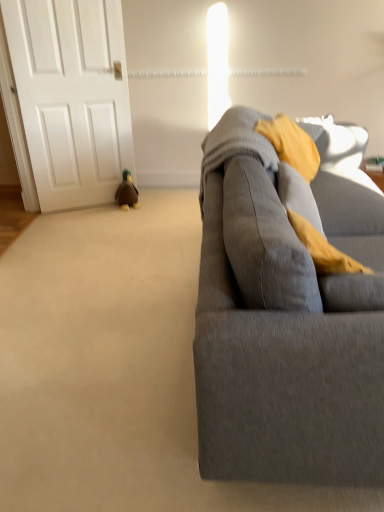
Describe the element at coordinates (127, 192) in the screenshot. I see `brown plush duck at lower left` at that location.

Image resolution: width=384 pixels, height=512 pixels. Identify the location of gray fabric couch at right. (288, 316).

Can you confirm if brown plush duck at lower left is thinner than white matte door at left?

Incorrect, the width of brown plush duck at lower left is not less than that of white matte door at left.

Is brown plush duck at lower left bigger or smaller than white matte door at left?

Clearly, brown plush duck at lower left is smaller in size than white matte door at left.

Could you tell me if brown plush duck at lower left is facing white matte door at left?

No, brown plush duck at lower left is not aimed at white matte door at left.

Is there a large distance between brown plush duck at lower left and white matte door at left?

No, brown plush duck at lower left is in close proximity to white matte door at left.

What's the angular difference between gray fabric couch at right and white matte door at left's facing directions?

The facing directions of gray fabric couch at right and white matte door at left are 65.6 degrees apart.

Is gray fabric couch at right not close to white matte door at left?

Absolutely, gray fabric couch at right is distant from white matte door at left.

Can you confirm if gray fabric couch at right is positioned to the left of white matte door at left?

No.

Is gray fabric couch at right positioned in front of white matte door at left?

Yes, gray fabric couch at right is in front of white matte door at left.

Which object is wider, white matte door at left or gray fabric couch at right?

Wider between the two is gray fabric couch at right.

Is white matte door at left bigger than gray fabric couch at right?

Actually, white matte door at left might be smaller than gray fabric couch at right.

Does white matte door at left have a greater height compared to gray fabric couch at right?

Indeed, white matte door at left has a greater height compared to gray fabric couch at right.

From the image's perspective, is white matte door at left above or below brown plush duck at lower left?

white matte door at left is above brown plush duck at lower left.

Where is `door above the brown plush duck at lower left (from the image's perspective)`? Image resolution: width=384 pixels, height=512 pixels. door above the brown plush duck at lower left (from the image's perspective) is located at coordinates pyautogui.click(x=67, y=100).

Based on the photo, is white matte door at left in front of or behind brown plush duck at lower left in the image?

Visually, white matte door at left is located in front of brown plush duck at lower left.

From a real-world perspective, who is located lower, white matte door at left or brown plush duck at lower left?

brown plush duck at lower left.

Is point (259, 256) positioned after point (119, 191)?

No, (259, 256) is in front of (119, 191).

Could you tell me if gray fabric couch at right is facing brown plush duck at lower left?

No, gray fabric couch at right is not oriented towards brown plush duck at lower left.

In the image, is gray fabric couch at right on the left side or the right side of brown plush duck at lower left?

Clearly, gray fabric couch at right is on the right of brown plush duck at lower left in the image.

Are gray fabric couch at right and brown plush duck at lower left located far from each other?

Yes, gray fabric couch at right is far from brown plush duck at lower left.

Looking at this image, from a real-world perspective, is brown plush duck at lower left physically located above or below gray fabric couch at right?

Clearly, from a real-world perspective, brown plush duck at lower left is below gray fabric couch at right.

Find the location of a particular element. Image resolution: width=384 pixels, height=512 pixels. studio couch in front of the brown plush duck at lower left is located at coordinates (288, 316).

Is brown plush duck at lower left in front of or behind gray fabric couch at right in the image?

Clearly, brown plush duck at lower left is behind gray fabric couch at right.

Would you say brown plush duck at lower left is a long distance from gray fabric couch at right?

Yes, brown plush duck at lower left and gray fabric couch at right are located far from each other.

In the image, there is a brown plush duck at lower left. At what (x,y) coordinates should I click in order to perform the action: click on door above it (from the image's perspective). Please return your answer as a coordinate pair (x, y). Looking at the image, I should click on (67, 100).

Find the location of a particular element. studio couch on the right of white matte door at left is located at coordinates (288, 316).

Estimate the real-world distances between objects in this image. Which object is further from brown plush duck at lower left, white matte door at left or gray fabric couch at right?

Based on the image, gray fabric couch at right appears to be further to brown plush duck at lower left.

Looking at the image, which one is located closer to white matte door at left, gray fabric couch at right or brown plush duck at lower left?

Among the two, brown plush duck at lower left is located nearer to white matte door at left.

Estimate the real-world distances between objects in this image. Which object is closer to gray fabric couch at right, white matte door at left or brown plush duck at lower left?

white matte door at left is closer to gray fabric couch at right.

When comparing their distances from white matte door at left, does brown plush duck at lower left or gray fabric couch at right seem further?

Based on the image, gray fabric couch at right appears to be further to white matte door at left.

Which object lies further to the anchor point brown plush duck at lower left, gray fabric couch at right or white matte door at left?

The object further to brown plush duck at lower left is gray fabric couch at right.

Estimate the real-world distances between objects in this image. Which object is closer to gray fabric couch at right, brown plush duck at lower left or white matte door at left?

The object closer to gray fabric couch at right is white matte door at left.

Identify the location of door positioned between gray fabric couch at right and brown plush duck at lower left from near to far. The height and width of the screenshot is (512, 384). (67, 100).